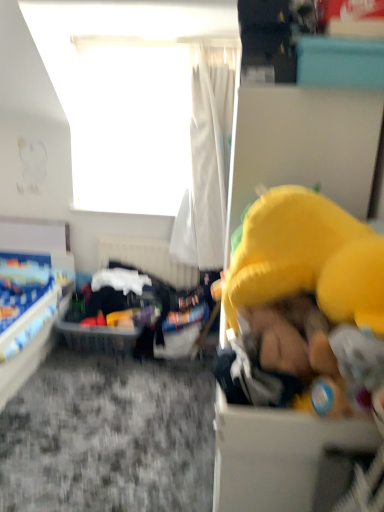
This screenshot has width=384, height=512. I want to click on blank space situated above white fabric bed frame at center (from a real-world perspective), so (x=151, y=236).